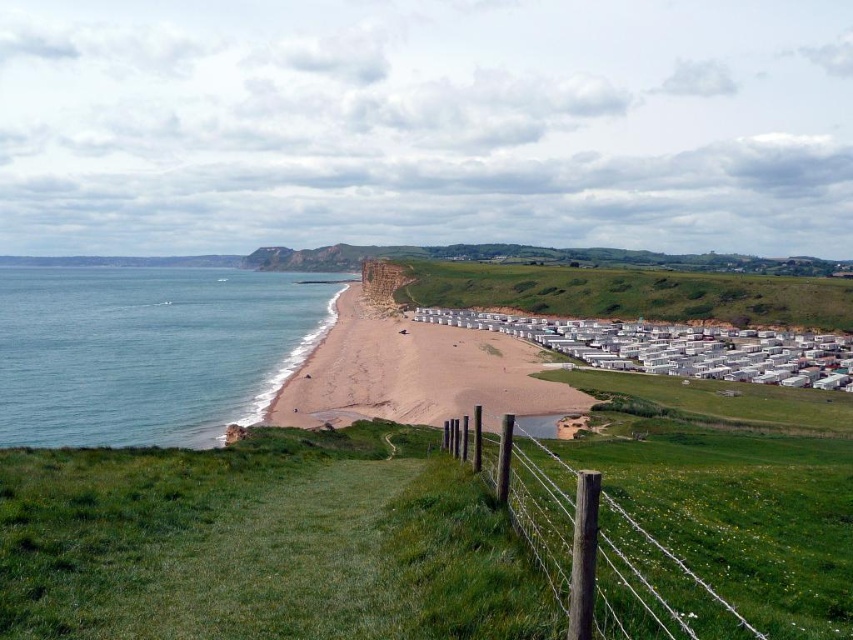
Which of these two, light brown sand at center or brown wooden fence at lower right, stands shorter?

With less height is brown wooden fence at lower right.

Can you confirm if light brown sand at center is smaller than brown wooden fence at lower right?

No.

Between point (302, 371) and point (668, 588), which one is positioned behind?

Positioned behind is point (302, 371).

Find the location of a particular element. Image resolution: width=853 pixels, height=640 pixels. light brown sand at center is located at coordinates (415, 372).

Is blue water at lower left above brown wooden fence at lower right?

Yes.

Does blue water at lower left come behind brown wooden fence at lower right?

Yes, blue water at lower left is further from the viewer.

Where is `blue water at lower left`? blue water at lower left is located at coordinates (148, 349).

Image resolution: width=853 pixels, height=640 pixels. I want to click on blue water at lower left, so click(x=148, y=349).

Between blue water at lower left and light brown sand at center, which one is positioned lower?

light brown sand at center is lower down.

Is point (192, 392) behind point (357, 342)?

No, it is in front of (357, 342).

The image size is (853, 640). What are the coordinates of `blue water at lower left` in the screenshot? It's located at (148, 349).